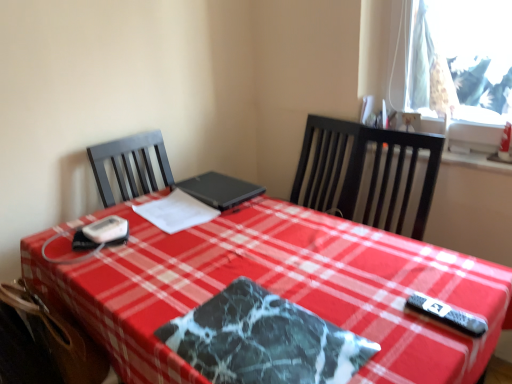
Question: Is marble-patterned placemat at center situated inside brown leather swivel chair at lower left or outside?

Choices:
 (A) inside
 (B) outside

Answer: (B)

Question: Visually, is marble-patterned placemat at center positioned to the left or to the right of brown leather swivel chair at lower left?

Choices:
 (A) left
 (B) right

Answer: (B)

Question: Which object is the closest to the white paper at center?

Choices:
 (A) brown leather swivel chair at lower left
 (B) black matte laptop at center
 (C) marble-patterned placemat at center

Answer: (B)

Question: Which of these objects is positioned farthest from the black matte laptop at center?

Choices:
 (A) white paper at center
 (B) marble-patterned placemat at center
 (C) brown leather swivel chair at lower left

Answer: (C)